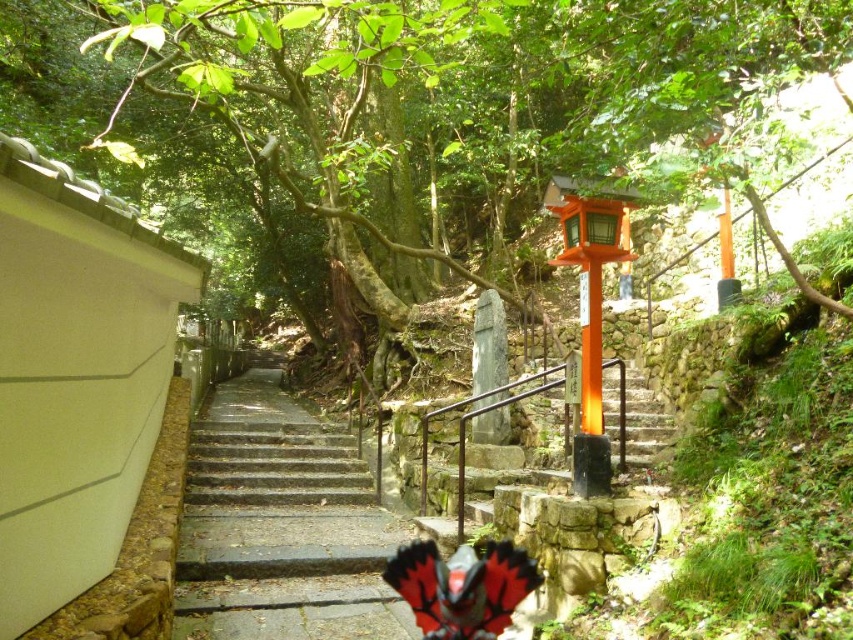
Question: Can you confirm if stone steps at center is thinner than orange matte/stained wood stairs at center?

Choices:
 (A) yes
 (B) no

Answer: (A)

Question: From the image, what is the correct spatial relationship of green leafy tree at center in relation to stone steps at center?

Choices:
 (A) above
 (B) below

Answer: (A)

Question: Which point appears closest to the camera in this image?

Choices:
 (A) (460, 84)
 (B) (480, 413)
 (C) (337, 442)

Answer: (B)

Question: Which point appears closest to the camera in this image?

Choices:
 (A) (770, 67)
 (B) (419, 522)
 (C) (387, 620)

Answer: (C)

Question: Does green leafy tree at center have a lesser width compared to orange matte/stained wood stairs at center?

Choices:
 (A) no
 (B) yes

Answer: (A)

Question: Which point is farther to the camera?

Choices:
 (A) stone steps at center
 (B) orange matte/stained wood stairs at center

Answer: (B)